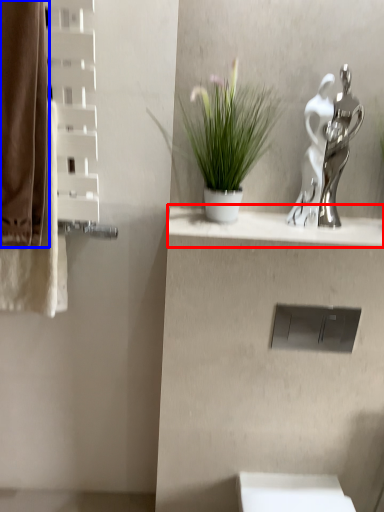
Question: Which object is further to the camera taking this photo, balustrade (highlighted by a red box) or curtain (highlighted by a blue box)?

Choices:
 (A) balustrade
 (B) curtain

Answer: (A)